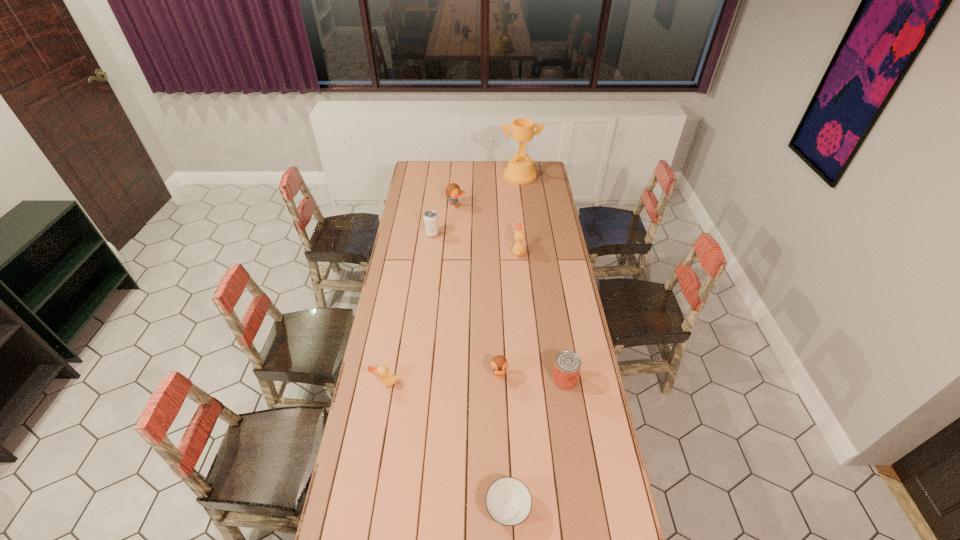
You are a GUI agent. You are given a task and a screenshot of the screen. Output one action in this format:
    pyautogui.click(x=<x>, y=<y>)
    Task: Click on the object at the far right corner
    This screenshot has height=540, width=960.
    Given the screenshot: What is the action you would take?
    pyautogui.click(x=520, y=170)

You are a GUI agent. You are given a task and a screenshot of the screen. Output one action in this format:
    pyautogui.click(x=<x>, y=<y>)
    Task: Click on the vacant region at the far edge
    The width and height of the screenshot is (960, 540).
    Given the screenshot: What is the action you would take?
    pyautogui.click(x=450, y=179)

I want to click on vacant space at the left edge of the desktop, so click(x=385, y=305).

This screenshot has width=960, height=540. Find the location of `vacant area at the right edge of the desktop`. vacant area at the right edge of the desktop is located at coordinates (579, 401).

At what (x,y) coordinates should I click in order to perform the action: click on free space between the shortest object and the left tan duck. Please return your answer as a coordinate pair (x, y). This screenshot has height=540, width=960. Looking at the image, I should click on (447, 446).

The width and height of the screenshot is (960, 540). I want to click on vacant point located between the left tan duck and the can, so click(x=475, y=381).

This screenshot has width=960, height=540. Identify the location of vacant point located between the nearer blue duck and the farther blue duck. (477, 292).

This screenshot has height=540, width=960. Find the location of `free spot between the rightmost duck and the nearer tan duck`. free spot between the rightmost duck and the nearer tan duck is located at coordinates (452, 317).

You are a GUI agent. You are given a task and a screenshot of the screen. Output one action in this format:
    pyautogui.click(x=<x>, y=<y>)
    Task: Click on the free space between the smaller blue duck and the shortest object
    This screenshot has height=540, width=960.
    Given the screenshot: What is the action you would take?
    pyautogui.click(x=503, y=443)

The image size is (960, 540). I want to click on free point between the right blue duck and the nearer tan duck, so click(x=443, y=380).